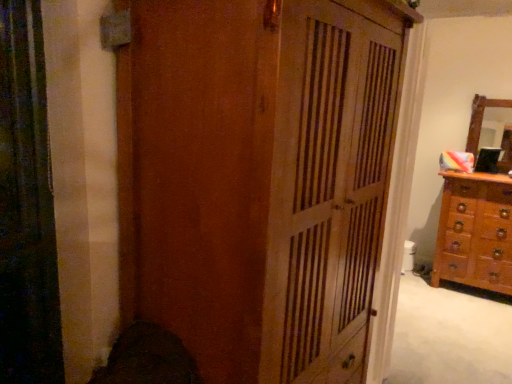
Question: Based on their positions, is wooden chest of drawers at right located to the left or right of wooden cupboard at center?

Choices:
 (A) left
 (B) right

Answer: (B)

Question: In terms of height, does wooden chest of drawers at right look taller or shorter compared to wooden cupboard at center?

Choices:
 (A) short
 (B) tall

Answer: (A)

Question: Based on their relative distances, which object is nearer to the wooden chest of drawers at right?

Choices:
 (A) wooden cupboard at center
 (B) wooden mirror at right

Answer: (B)

Question: Considering the real-world distances, which object is closest to the wooden cupboard at center?

Choices:
 (A) wooden chest of drawers at right
 (B) wooden mirror at right

Answer: (A)